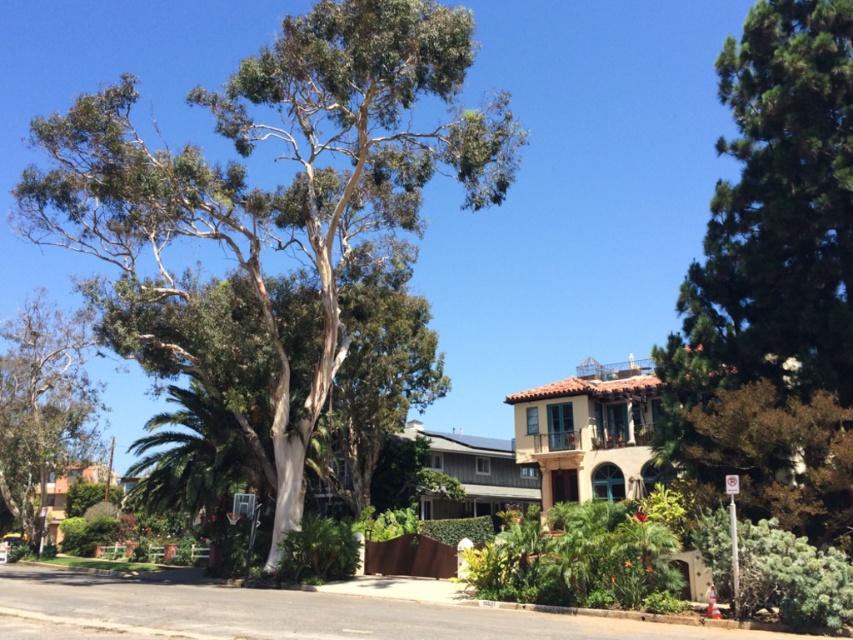
Can you confirm if green leafy tree at upper left is positioned above green leafy tree at center?

Yes.

Is point (474, 157) farther from camera compared to point (45, 337)?

No, it is not.

Which is in front, point (335, 76) or point (27, 456)?

Point (335, 76) is in front.

Where is `green leafy tree at upper left`? This screenshot has height=640, width=853. green leafy tree at upper left is located at coordinates (276, 196).

Which of these two, green textured tree at upper right or green leafy tree at center, stands shorter?

With less height is green textured tree at upper right.

Is point (842, 298) positioned in front of point (19, 452)?

Yes, it is in front of point (19, 452).

This screenshot has height=640, width=853. Identify the location of green textured tree at upper right. click(775, 280).

Who is higher up, green leafy tree at upper left or green textured tree at upper right?

green leafy tree at upper left is above.

Which is below, green leafy tree at upper left or green textured tree at upper right?

green textured tree at upper right

Who is more forward, (88, 147) or (741, 211)?

Point (741, 211)

Find the location of a particular element. The width and height of the screenshot is (853, 640). green leafy tree at upper left is located at coordinates (276, 196).